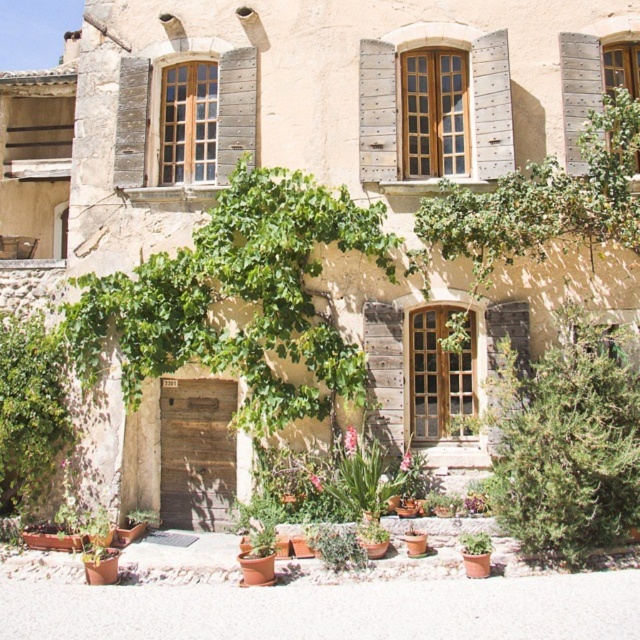
Can you confirm if green matte plant at lower right is bigger than green matte plant at lower center?

No.

Between green matte plant at lower right and green matte plant at lower center, which one appears on the right side from the viewer's perspective?

green matte plant at lower right

Between point (476, 548) and point (132, 525), which one is positioned behind?

The point (132, 525) is behind.

Where is `green matte plant at lower right`? The width and height of the screenshot is (640, 640). green matte plant at lower right is located at coordinates (476, 544).

What do you see at coordinates (29, 412) in the screenshot? Image resolution: width=640 pixels, height=640 pixels. I see `green leafy plant at lower left` at bounding box center [29, 412].

Between point (40, 340) and point (352, 561), which one is positioned in front?

Point (352, 561) is more forward.

Which is in front, point (56, 412) or point (349, 557)?

Point (349, 557)

This screenshot has height=640, width=640. What are the coordinates of `green leafy plant at lower left` in the screenshot? It's located at (29, 412).

Which of these two, green matte plant at center or green matte plant at lower center, stands taller?

With more height is green matte plant at center.

Is green matte plant at center wider than green matte plant at lower center?

Correct, the width of green matte plant at center exceeds that of green matte plant at lower center.

Does point (326, 564) come behind point (154, 524)?

No, (326, 564) is closer to viewer.

Identify the location of green matte plant at center. (337, 547).